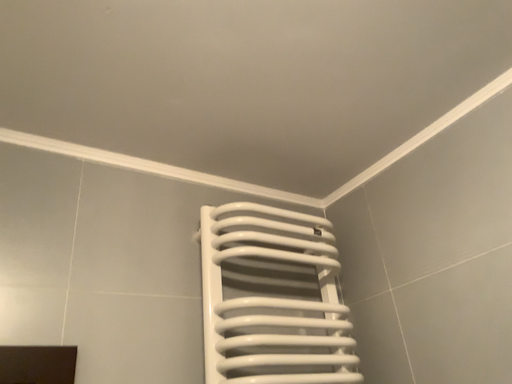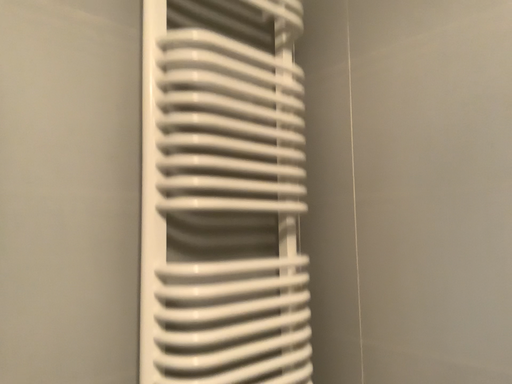
Question: Which way did the camera rotate in the video?

Choices:
 (A) rotated right
 (B) rotated left

Answer: (A)